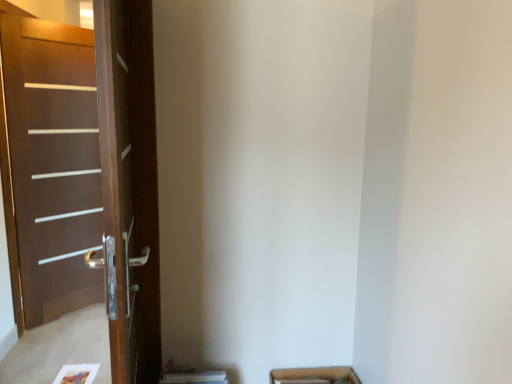
This screenshot has height=384, width=512. Describe the element at coordinates (129, 187) in the screenshot. I see `brown wooden screen door at left` at that location.

At what (x,y) coordinates should I click in order to perform the action: click on brown wooden screen door at left. Please return your answer as a coordinate pair (x, y). This screenshot has height=384, width=512. Looking at the image, I should click on (129, 187).

Measure the distance between brown wood door at left and camera.

A distance of 8.35 feet exists between brown wood door at left and camera.

Describe the element at coordinates (88, 174) in the screenshot. I see `brown wood door at left` at that location.

I want to click on brown wood door at left, so click(88, 174).

The image size is (512, 384). I want to click on brown wooden screen door at left, so click(x=129, y=187).

Considering the relative positions of brown wooden screen door at left and brown wood door at left in the image provided, is brown wooden screen door at left to the right of brown wood door at left from the viewer's perspective?

Yes, brown wooden screen door at left is to the right of brown wood door at left.

Is brown wooden screen door at left further to camera compared to brown wood door at left?

No, brown wooden screen door at left is closer to the camera.

Is point (154, 231) behind point (42, 206)?

No, it is not.

From the image's perspective, between brown wooden screen door at left and brown wood door at left, which one is located above?

brown wood door at left appears higher in the image.

Based on the photo, from a real-world perspective, is brown wooden screen door at left located higher than brown wood door at left?

Yes, from a real-world perspective, brown wooden screen door at left is over brown wood door at left

Which of these two, brown wooden screen door at left or brown wood door at left, is thinner?

Thinner between the two is brown wood door at left.

In terms of height, does brown wooden screen door at left look taller or shorter compared to brown wood door at left?

Considering their sizes, brown wooden screen door at left has less height than brown wood door at left.

Does brown wooden screen door at left have a smaller size compared to brown wood door at left?

Actually, brown wooden screen door at left might be larger than brown wood door at left.

Is brown wooden screen door at left outside of brown wood door at left?

brown wooden screen door at left lies outside brown wood door at left's area.

Would you consider brown wooden screen door at left to be distant from brown wood door at left?

Yes, brown wooden screen door at left is far from brown wood door at left.

Could you tell me if brown wooden screen door at left is facing brown wood door at left?

No, brown wooden screen door at left is not aimed at brown wood door at left.

In the scene shown: How many degrees apart are the facing directions of brown wooden screen door at left and brown wood door at left?

83 degrees separate the facing orientations of brown wooden screen door at left and brown wood door at left.

Find the location of a particular element. The width and height of the screenshot is (512, 384). door above the brown wooden screen door at left (from the image's perspective) is located at coordinates (88, 174).

Is brown wood door at left to the right of brown wooden screen door at left from the viewer's perspective?

Incorrect, brown wood door at left is not on the right side of brown wooden screen door at left.

Considering their positions, is brown wood door at left located in front of or behind brown wooden screen door at left?

Visually, brown wood door at left is located behind brown wooden screen door at left.

Does point (54, 313) appear closer or farther from the camera than point (152, 301)?

Point (54, 313) is positioned farther from the camera compared to point (152, 301).

From the image's perspective, is brown wood door at left below brown wooden screen door at left?

No, from the image's perspective, brown wood door at left is not below brown wooden screen door at left.

From a real-world perspective, which is physically above, brown wood door at left or brown wooden screen door at left?

In real-world perspective, brown wooden screen door at left is above.

Does brown wood door at left have a lesser width compared to brown wooden screen door at left?

Indeed, brown wood door at left has a lesser width compared to brown wooden screen door at left.

Considering the sizes of brown wood door at left and brown wooden screen door at left in the image, is brown wood door at left taller or shorter than brown wooden screen door at left?

Clearly, brown wood door at left is taller compared to brown wooden screen door at left.

Can you confirm if brown wood door at left is smaller than brown wooden screen door at left?

Correct, brown wood door at left occupies less space than brown wooden screen door at left.

Is brown wooden screen door at left located within brown wood door at left?

No, brown wooden screen door at left is located outside of brown wood door at left.

Would you say brown wood door at left is a long distance from brown wooden screen door at left?

brown wood door at left is far away from brown wooden screen door at left.

Is brown wood door at left facing away from brown wooden screen door at left?

brown wood door at left is not turned away from brown wooden screen door at left.

How far apart are brown wood door at left and brown wooden screen door at left?

1.47 meters.

The width and height of the screenshot is (512, 384). I want to click on screen door on the right of brown wood door at left, so click(129, 187).

You are a GUI agent. You are given a task and a screenshot of the screen. Output one action in this format:
    pyautogui.click(x=<x>, y=<y>)
    Task: Click on the screen door in front of the brown wood door at left
    The height and width of the screenshot is (384, 512).
    Given the screenshot: What is the action you would take?
    pyautogui.click(x=129, y=187)

This screenshot has width=512, height=384. What are the coordinates of `door above the brown wooden screen door at left (from the image's perspective)` in the screenshot? It's located at (88, 174).